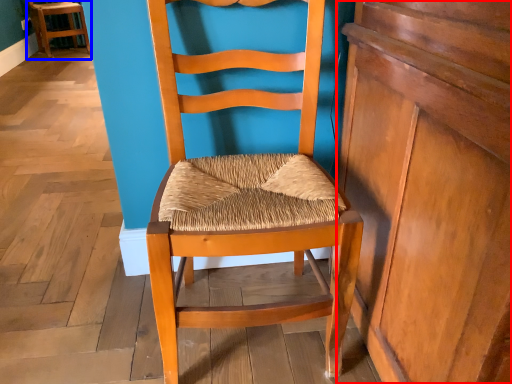
Question: Which point is further to the camera, dresser (highlighted by a red box) or chair (highlighted by a blue box)?

Choices:
 (A) dresser
 (B) chair

Answer: (B)